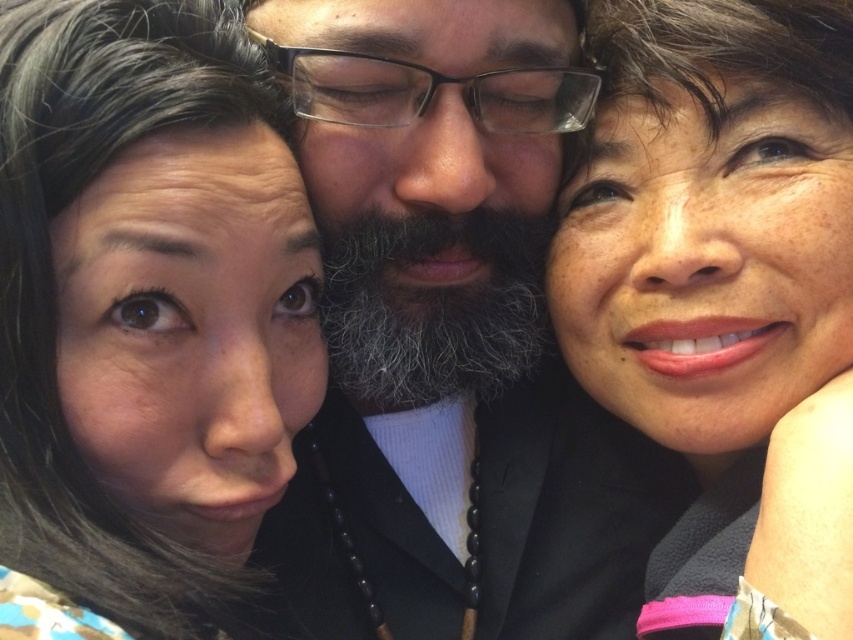
You are a photographer trying to adjust the framing for a group photo. You notice the two faces labeled as smooth skin face at upper left and smooth skin face at upper right. Based on their widths, which face should you adjust to ensure both faces appear balanced in the frame?

The smooth skin face at upper left has a smaller width compared to the smooth skin face at upper right. To balance them, you should adjust the smooth skin face at upper left to be wider or move it closer to the camera so that both faces have similar widths in the frame.

You are taking a photo of three friends and want to ensure that the person at point [354,64] and the person at point [766,576] are both in focus. Based on the image description, which person should be closer to the camera?

The person at point [766,576] is closer to the camera since point [354,64] is behind it.